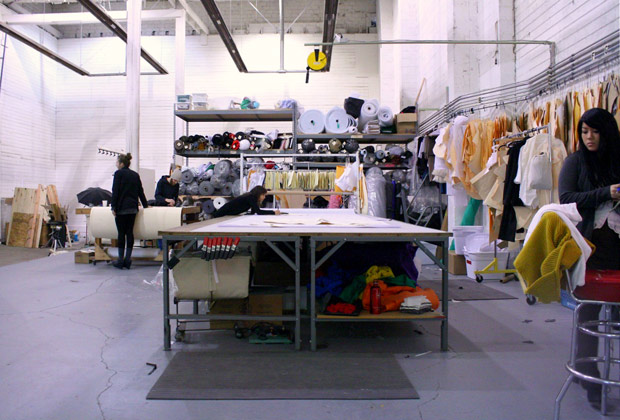
Identify the location of yellow fabric. (550, 262).